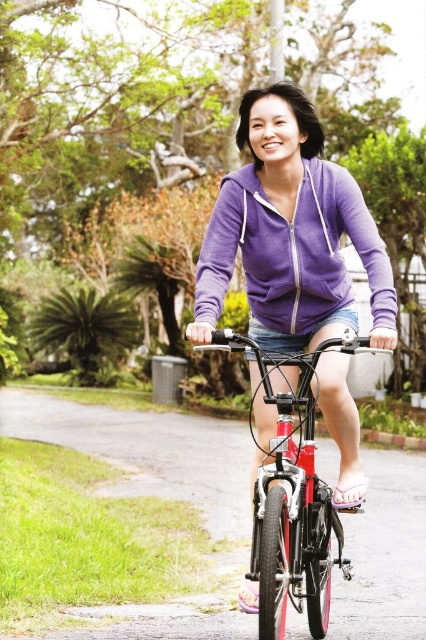
Is purple fleece sweatshirt at center smaller than shiny metallic bicycle at center?

Yes, purple fleece sweatshirt at center is smaller than shiny metallic bicycle at center.

Does purple fleece sweatshirt at center have a greater width compared to shiny metallic bicycle at center?

Yes.

At what (x,y) coordinates should I click in order to perform the action: click on purple fleece sweatshirt at center. Please return your answer as a coordinate pair (x, y). The height and width of the screenshot is (640, 426). Looking at the image, I should click on (293, 250).